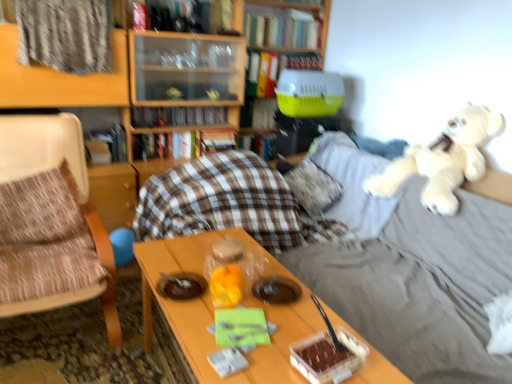
The width and height of the screenshot is (512, 384). I want to click on blank space above wooden table at center (from a real-world perspective), so click(251, 306).